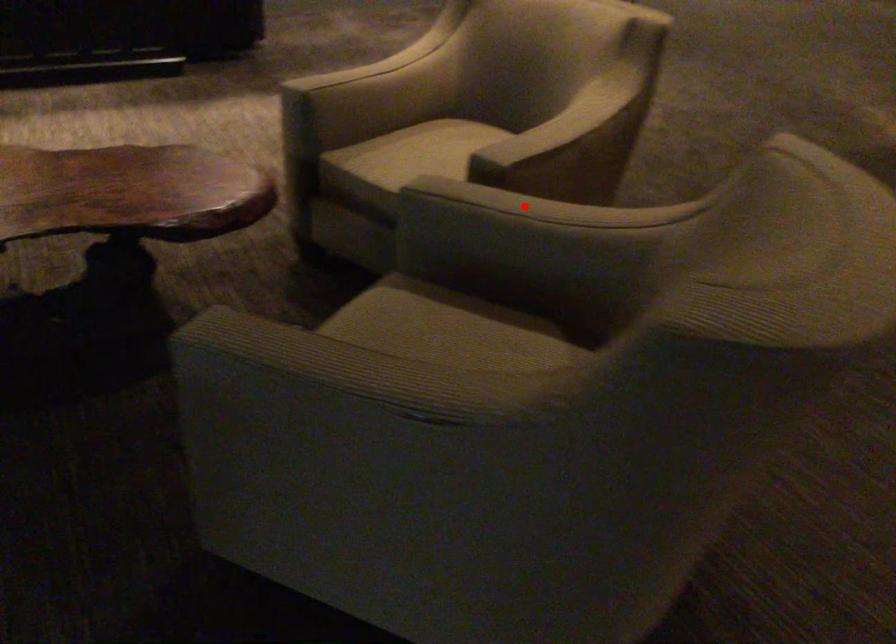
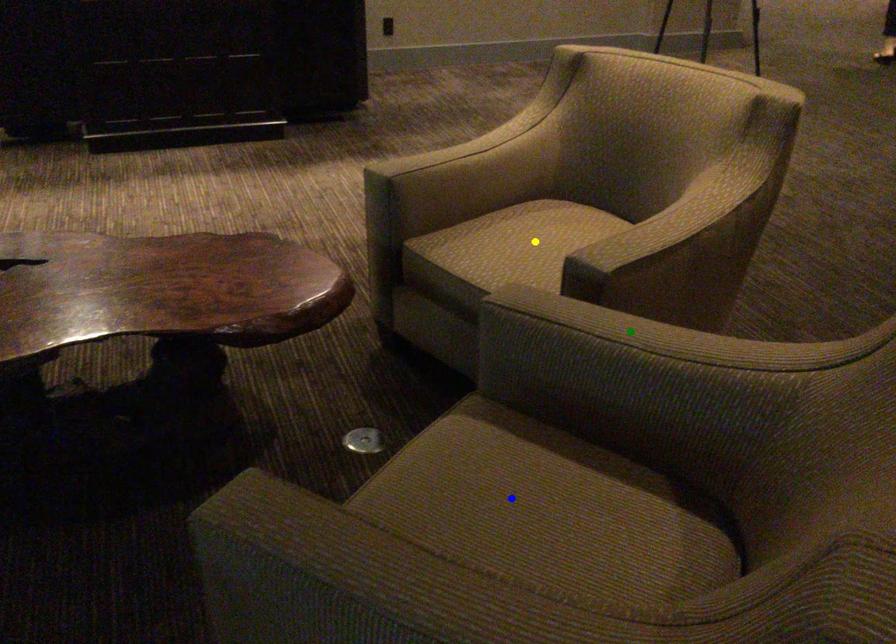
Question: I am providing you with two images of the same scene from different viewpoints. A red point is marked on the first image. You are given multiple points on the second image. Which point in image 2 represents the same 3d spot as the red point in image 1?

Choices:
 (A) blue point
 (B) green point
 (C) yellow point

Answer: (B)